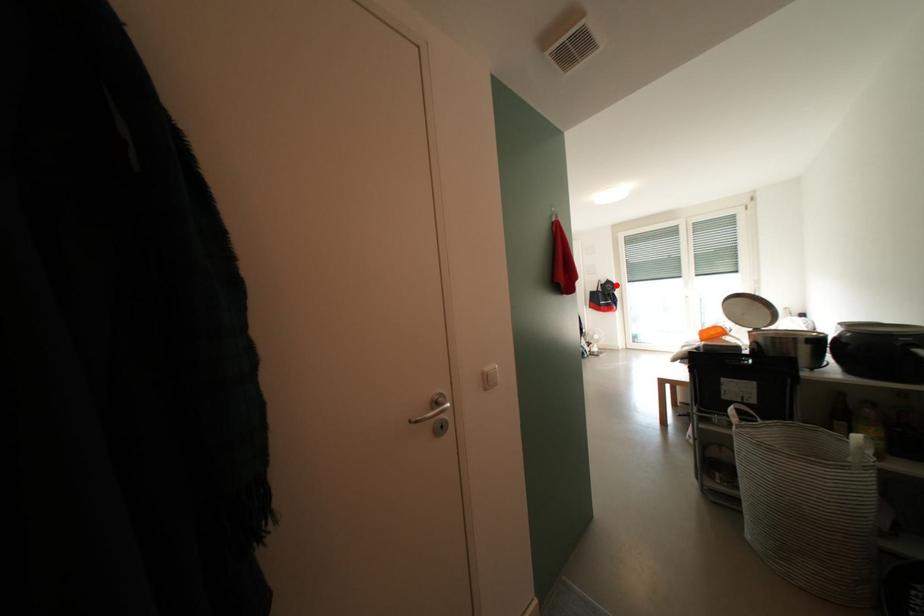
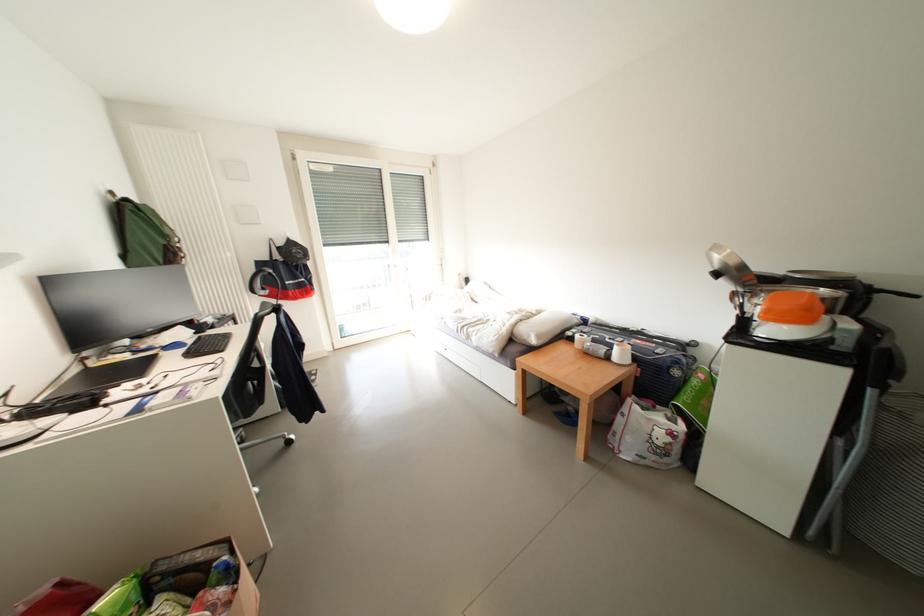
Find the pixel in the second image that matches the highlighted location in the first image.

(298, 246)